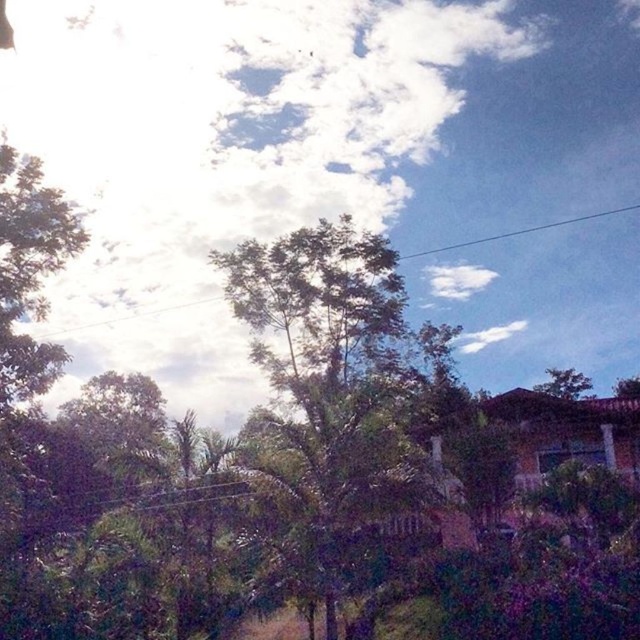
You are standing in the serene outdoor scene and notice two green leafy trees. Which one is positioned higher up in the image, the green leafy tree at center or the green leafy tree at upper right?

The green leafy tree at center is located above the green leafy tree at upper right, so it is positioned higher up in the image.

In the scene shown: You are an airplane pilot flying at a low altitude. You notice the white fluffy cloud at upper center and the green leafy tree at upper right in your view. Which object is nearer to your current position?

The white fluffy cloud at upper center is closer to the viewer than the green leafy tree at upper right, so the cloud is nearer to your current position.

You are looking at the sky and see the white fluffy cloud at upper center and the green leafy tree at upper right. Which object is higher in the sky?

The white fluffy cloud at upper center is higher in the sky than the green leafy tree at upper right because it is located above it.